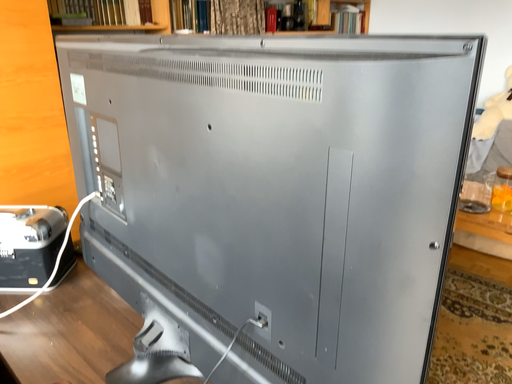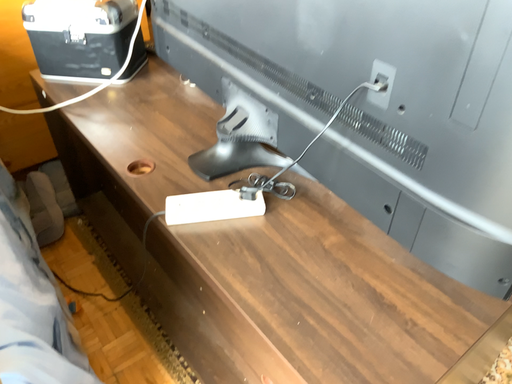
Question: Which way did the camera rotate in the video?

Choices:
 (A) rotated downward
 (B) rotated upward

Answer: (A)